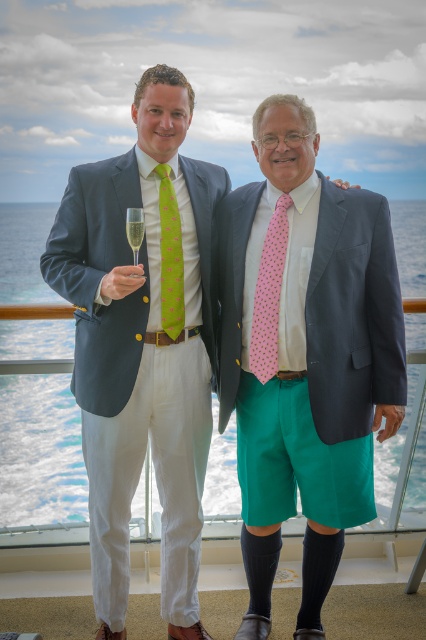
From the picture: You are a photographer on the cruise ship deck. You need to take a photo of the two men. The man on the left has a pink printed tie at center and a clear glass at center. Which object is taller in the photo?

The pink printed tie at center is taller than the clear glass at center in the photo.

Based on the photo, what is the location of the point with coordinates [169,257] in the scene?

The point with coordinates [169,257] is located on the green printed tie at center.

You are a photographer taking a photo of two men on a cruise ship deck. You notice their ties. Which tie, the pink printed tie at center or the green printed tie at center, is positioned to the right side of the other?

The pink printed tie at center is positioned to the right of the green printed tie at center.